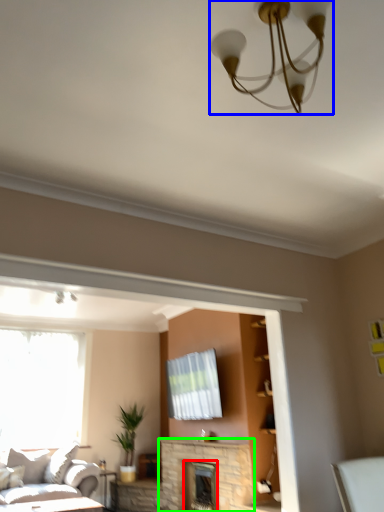
Question: Considering the real-world distances, which object is closest to fireplace (highlighted by a red box)? lamp (highlighted by a blue box) or fireplace (highlighted by a green box).

Choices:
 (A) lamp
 (B) fireplace

Answer: (B)